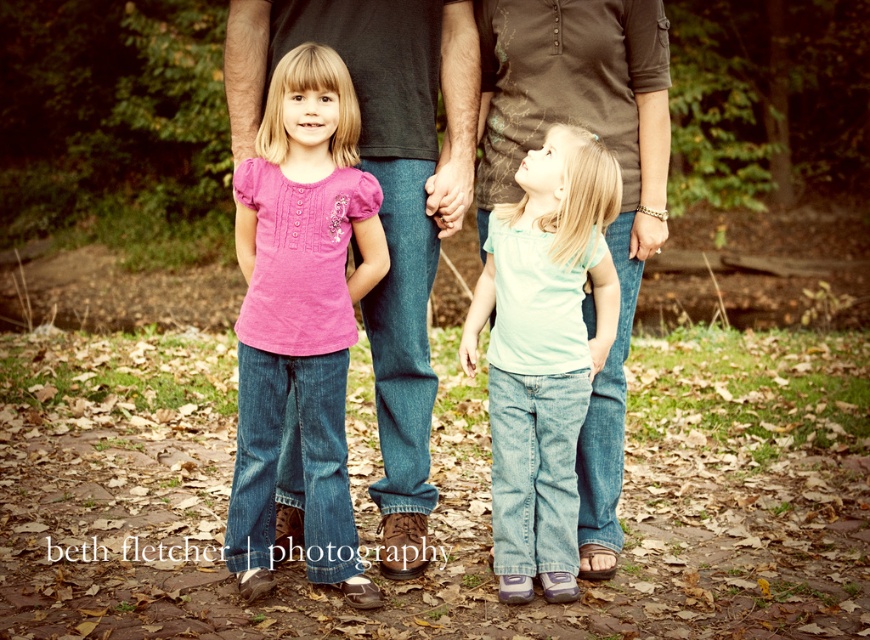
Is point (265, 54) farther from viewer compared to point (472, 317)?

Yes, point (265, 54) is farther from viewer.

Does point (405, 381) lie in front of point (500, 227)?

That is False.

This screenshot has height=640, width=870. In order to click on matte black shirt at center in this screenshot , I will do `click(385, 195)`.